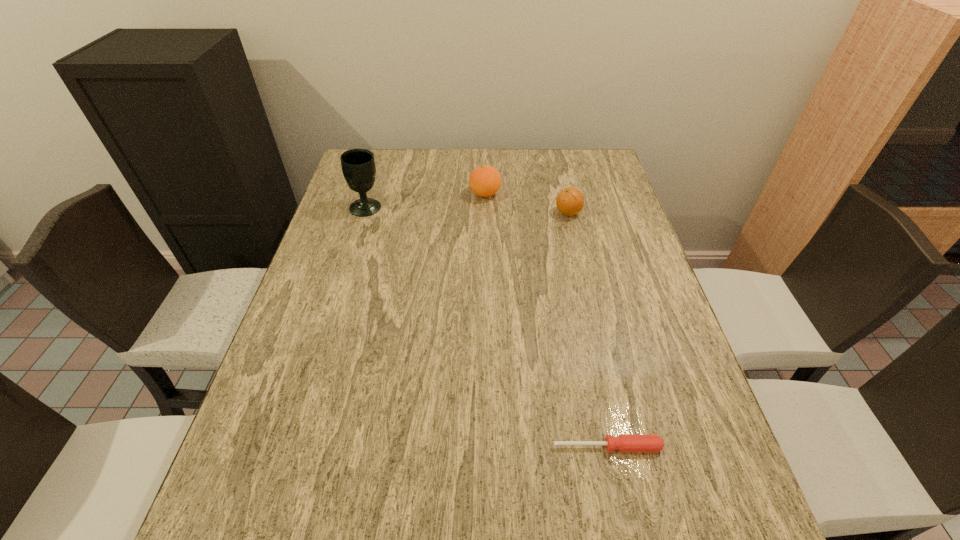
Locate an element on the screen. vacant space located 0.390m on the left of the right orange is located at coordinates 426,213.

Find the location of a particular element. free space located on the front of the shortest object is located at coordinates (621, 512).

Locate an element on the screen. The height and width of the screenshot is (540, 960). object that is positioned at the far edge is located at coordinates (484, 181).

This screenshot has width=960, height=540. Find the location of `object that is at the left edge`. object that is at the left edge is located at coordinates (358, 166).

Locate an element on the screen. This screenshot has height=540, width=960. orange that is at the right edge is located at coordinates (570, 201).

The height and width of the screenshot is (540, 960). Identify the location of screwdriver that is at the right edge. (625, 443).

The width and height of the screenshot is (960, 540). Identify the location of vacant space at the far edge. (538, 151).

Locate an element on the screen. free spot at the left edge of the desktop is located at coordinates (303, 370).

At what (x,y) coordinates should I click in order to perform the action: click on free region at the right edge. Please return your answer as a coordinate pair (x, y). This screenshot has height=540, width=960. Looking at the image, I should click on (588, 206).

Image resolution: width=960 pixels, height=540 pixels. Identify the location of vacant space at the far left corner of the desktop. (384, 181).